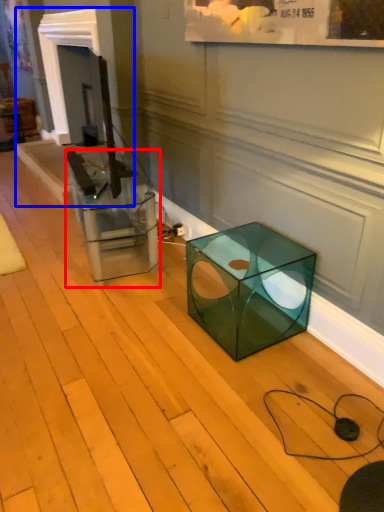
Question: Which object appears closest to the camera in this image, glass box (highlighted by a red box) or fireplace (highlighted by a blue box)?

Choices:
 (A) glass box
 (B) fireplace

Answer: (A)